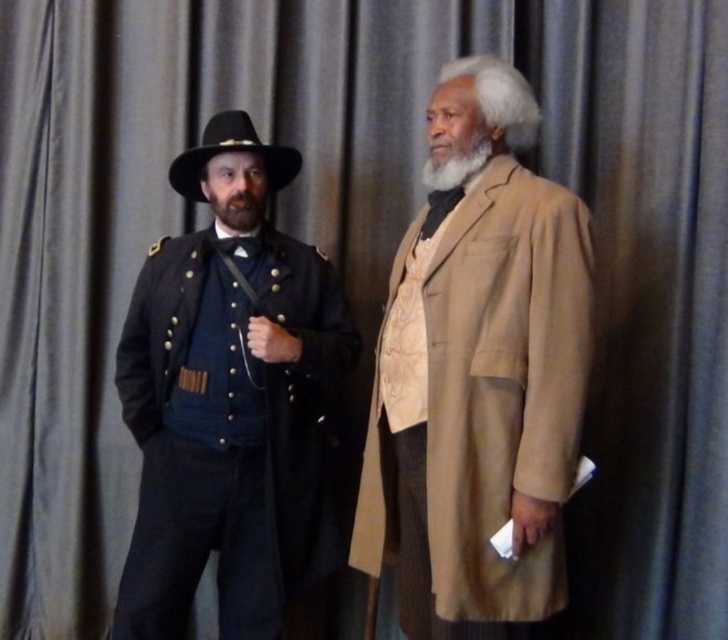
You are a photographer who needs to adjust the lighting to ensure both the black felt cowboy hat at left and the dark brown fuzzy beard at left are clearly visible. Since the hat is blocking some light from reaching the beard, which object should you move slightly backward to improve visibility?

The black felt cowboy hat at left is in front of the dark brown fuzzy beard at left, so moving the hat backward would allow more light to reach the beard, improving visibility.

You are a photographer who needs to ensure proper framing for a portrait. You observe the matte blue uniform at left and the graywoollybeard at right in your viewfinder. Based on their heights, which subject should you adjust your camera angle to focus on to capture both individuals adequately?

The matte blue uniform at left is taller than the graywoollybeard at right. To capture both adequately, adjust the camera angle to focus on the taller subject, the matte blue uniform at left, ensuring the shorter subject, graywoollybeard at right, remains in frame.

You are a photographer setting up a shoot. You need to position a spotlight so it illuminates both the matte blue uniform at left and the graywoollybeard at right equally. Given their positions, where should you place the spotlight relative to the two subjects?

The matte blue uniform at left is to the left of graywoollybeard at right, so placing the spotlight directly between them would ensure equal illumination on both subjects.